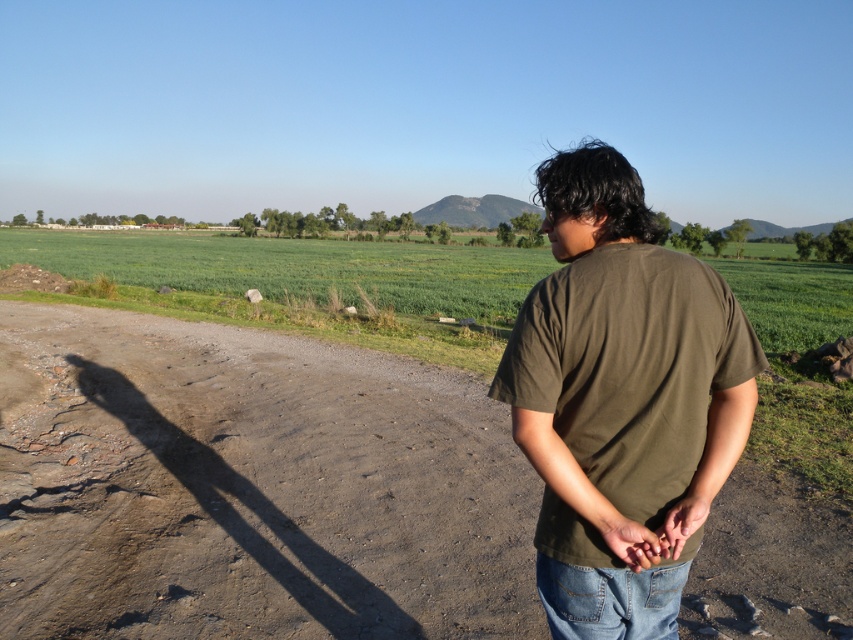
You are standing on the dirt track at center and want to walk towards the green grass field at center. Which direction should you walk to reach the field?

The dirt track at center is in front of the green grass field at center, so you should walk forward to reach the field.

You are standing on the dirt road in the rural scene and want to walk towards the point marked at coordinates point (74, 262) and point (547, 589). Which point will you reach first?

You will reach point (74, 262) first because it is closer to you than point (547, 589), which is further away.